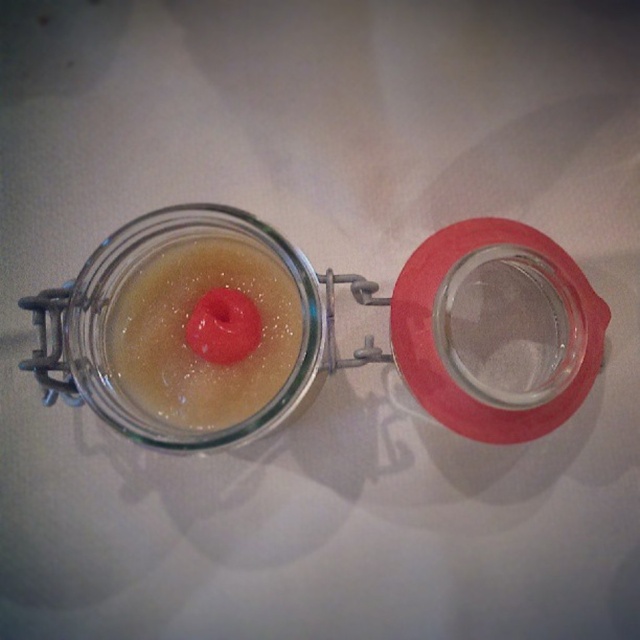
Question: Among these objects, which one is nearest to the camera?

Choices:
 (A) translucent gelatinous substance at center
 (B) transparent glass jar at upper center

Answer: (B)

Question: Which point appears farthest from the camera in this image?

Choices:
 (A) (129, 264)
 (B) (145, 348)

Answer: (A)

Question: Is translucent gelatinous substance at center bigger than transparent glass jar at upper center?

Choices:
 (A) no
 (B) yes

Answer: (A)

Question: Can you confirm if translucent gelatinous substance at center is positioned below transparent glass jar at upper center?

Choices:
 (A) no
 (B) yes

Answer: (A)

Question: Can you confirm if translucent gelatinous substance at center is smaller than transparent glass jar at upper center?

Choices:
 (A) yes
 (B) no

Answer: (A)